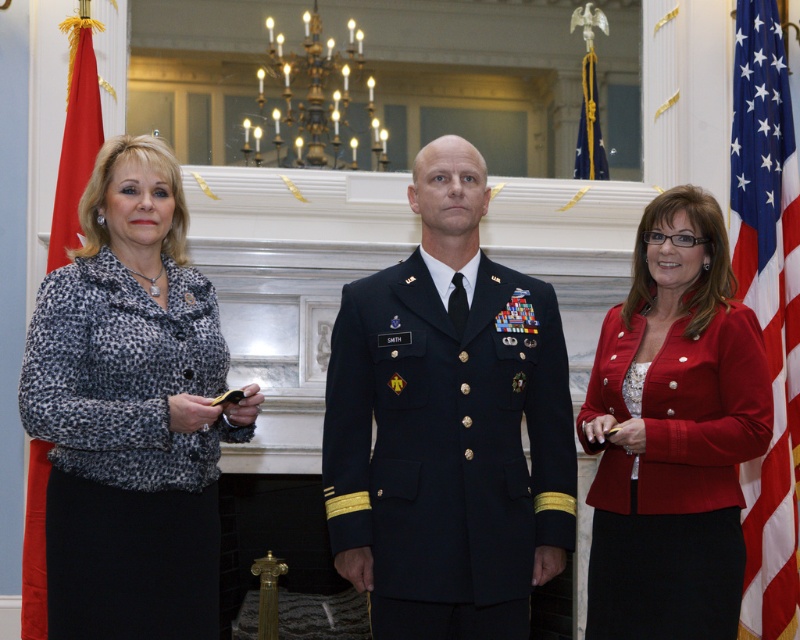
Between navy blue fabric military uniform at center and red fabric flag at left, which one appears on the right side from the viewer's perspective?

Positioned to the right is navy blue fabric military uniform at center.

What do you see at coordinates (448, 445) in the screenshot? The height and width of the screenshot is (640, 800). I see `navy blue fabric military uniform at center` at bounding box center [448, 445].

Locate an element on the screen. Image resolution: width=800 pixels, height=640 pixels. navy blue fabric military uniform at center is located at coordinates (448, 445).

Does navy blue fabric military uniform at center have a larger size compared to american flag at right?

Indeed, navy blue fabric military uniform at center has a larger size compared to american flag at right.

Can you confirm if navy blue fabric military uniform at center is shorter than american flag at right?

In fact, navy blue fabric military uniform at center may be taller than american flag at right.

Between point (346, 518) and point (740, 76), which one is positioned in front?

Point (346, 518) is in front.

Find the location of a particular element. This screenshot has height=640, width=800. navy blue fabric military uniform at center is located at coordinates (448, 445).

Is the position of red satin blazer at center less distant than that of american flag at right?

Yes.

Is red satin blazer at center to the right of american flag at right from the viewer's perspective?

Incorrect, red satin blazer at center is not on the right side of american flag at right.

Is point (652, 432) more distant than point (752, 630)?

No, (652, 432) is in front of (752, 630).

You are a GUI agent. You are given a task and a screenshot of the screen. Output one action in this format:
    pyautogui.click(x=<x>, y=<y>)
    Task: Click on the red satin blazer at center
    Image resolution: width=800 pixels, height=640 pixels.
    Given the screenshot: What is the action you would take?
    pyautogui.click(x=674, y=433)